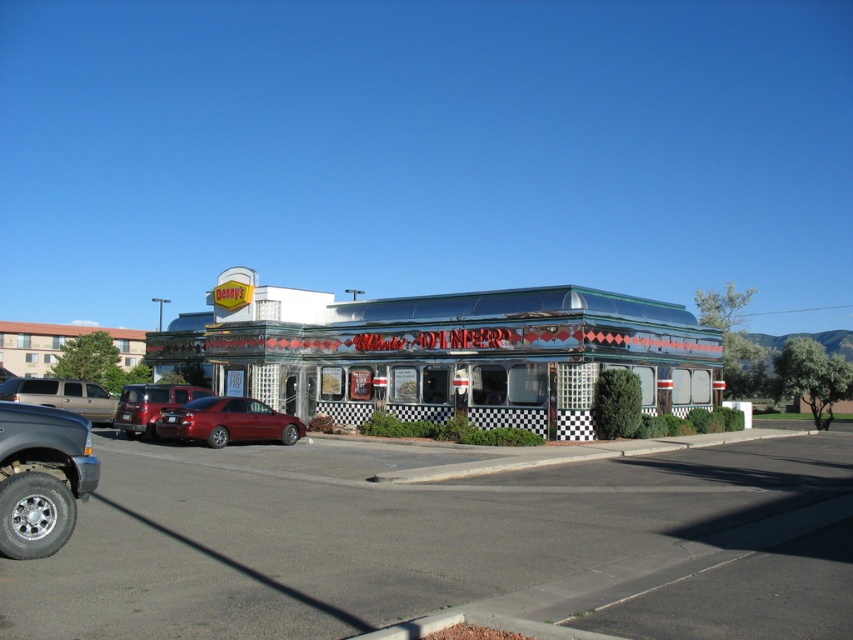
Question: Which object is closer to the camera taking this photo?

Choices:
 (A) smooth asphalt parking lot at lower left
 (B) metallic red sedan at center-left
 (C) metallic diner at center
 (D) gold metallic van at left

Answer: (A)

Question: Among these points, which one is farthest from the camera?

Choices:
 (A) (306, 308)
 (B) (444, 577)
 (C) (183, 403)

Answer: (A)

Question: Does metallic diner at center appear on the left side of gold metallic van at left?

Choices:
 (A) no
 (B) yes

Answer: (A)

Question: Is metallic diner at center thinner than metallic red sedan at center-left?

Choices:
 (A) yes
 (B) no

Answer: (B)

Question: Estimate the real-world distances between objects in this image. Which object is closer to the metallic red sedan at center-left?

Choices:
 (A) gold metallic van at left
 (B) metallic diner at center
 (C) glossy red sedan at center
 (D) smooth asphalt parking lot at lower left

Answer: (C)

Question: Is smooth asphalt parking lot at lower left bigger than metallic diner at center?

Choices:
 (A) no
 (B) yes

Answer: (A)